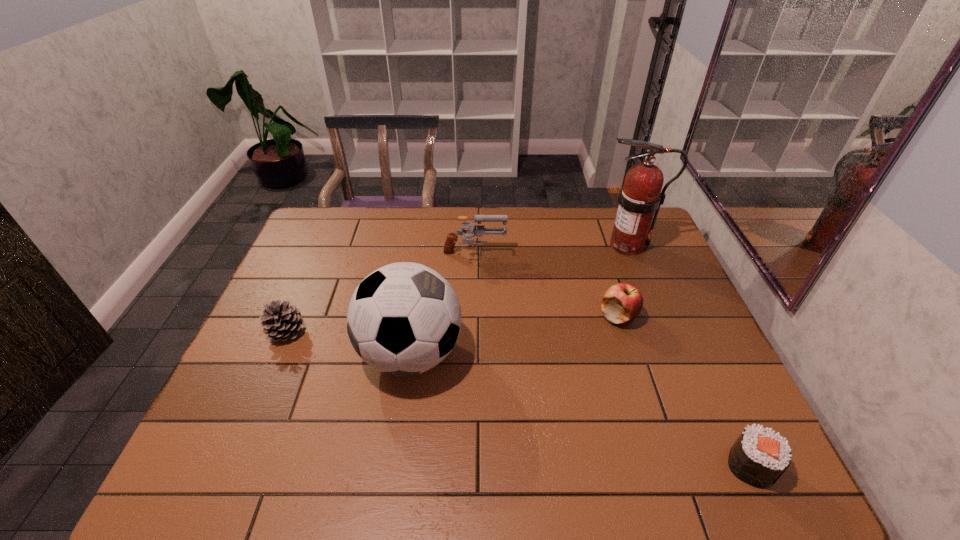
The height and width of the screenshot is (540, 960). I want to click on free space located 0.170m on the main logo of the soccer ball, so click(528, 354).

Find the location of a particular element. This screenshot has width=960, height=540. free space located at the barrel end of the gun is located at coordinates (624, 255).

The height and width of the screenshot is (540, 960). What are the coordinates of `vacant space situated on the back of the apple` in the screenshot? It's located at (600, 258).

I want to click on blank area located 0.220m on the right of the leftmost object, so click(386, 332).

Identify the location of free spot located 0.100m on the left of the nearest object. (681, 465).

Where is `fire extinguisher positioned at the far edge`? The height and width of the screenshot is (540, 960). fire extinguisher positioned at the far edge is located at coordinates (640, 197).

Where is `gun that is at the far edge`? The height and width of the screenshot is (540, 960). gun that is at the far edge is located at coordinates (479, 230).

You are a GUI agent. You are given a task and a screenshot of the screen. Output one action in this format:
    pyautogui.click(x=<x>, y=<y>)
    Task: Click on the object present at the near edge
    The width and height of the screenshot is (960, 540).
    Given the screenshot: What is the action you would take?
    pyautogui.click(x=759, y=457)

The width and height of the screenshot is (960, 540). Find the location of `object positioned at the left edge`. object positioned at the left edge is located at coordinates (281, 322).

Where is `fire extinguisher at the right edge`? The image size is (960, 540). fire extinguisher at the right edge is located at coordinates (640, 197).